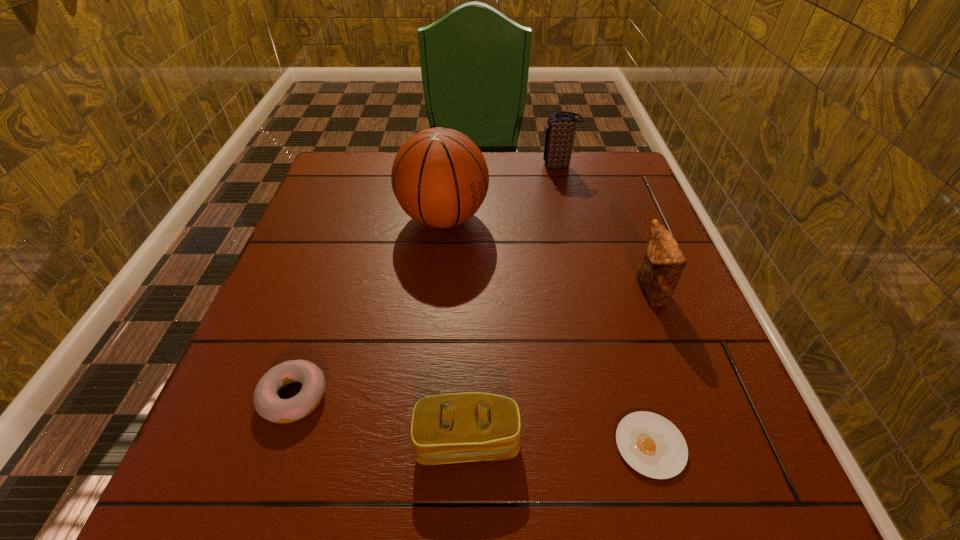
Identify the location of empty space that is in between the second shortest object and the nearest clutch bag. (381, 418).

Where is `free space between the second farthest object and the rightmost clutch bag`? The width and height of the screenshot is (960, 540). free space between the second farthest object and the rightmost clutch bag is located at coordinates (546, 255).

Locate an element on the screen. Image resolution: width=960 pixels, height=540 pixels. empty space between the third farthest object and the shortest object is located at coordinates (x=650, y=368).

Image resolution: width=960 pixels, height=540 pixels. What are the coordinates of `object identified as the closest to the fifth tallest object` in the screenshot? It's located at (459, 427).

Find the location of a particular element. The image size is (960, 540). object that is the fifth nearest to the shortest clutch bag is located at coordinates (560, 128).

This screenshot has height=540, width=960. Find the location of `clutch bag that is the third closest to the egg yolk`. clutch bag that is the third closest to the egg yolk is located at coordinates coord(560,128).

Select which clutch bag is the closest to the leftmost object. Please provide its 2D coordinates. Your answer should be formatted as a tuple, i.e. [(x, y)], where the tuple contains the x and y coordinates of a point satisfying the conditions above.

[(459, 427)]